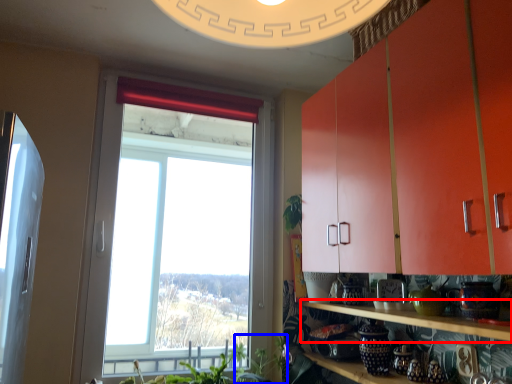
Question: Which object is further to the camera taking this photo, shelf (highlighted by a red box) or plant (highlighted by a blue box)?

Choices:
 (A) shelf
 (B) plant

Answer: (B)